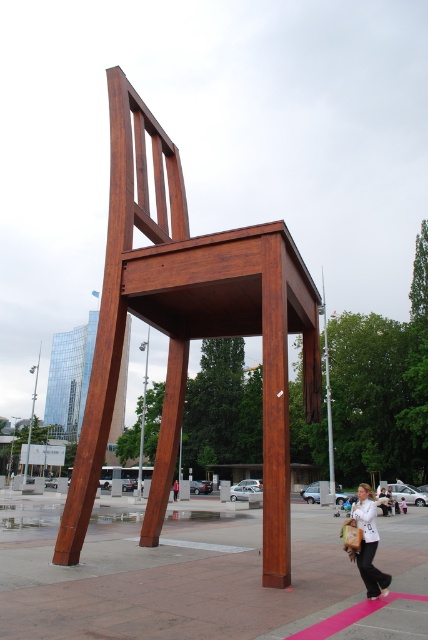
Is wooden chair at center positioned at the back of white cotton shirt at lower right?

Yes, wooden chair at center is behind white cotton shirt at lower right.

You are a GUI agent. You are given a task and a screenshot of the screen. Output one action in this format:
    pyautogui.click(x=<x>, y=<y>)
    Task: Click on the wooden chair at center
    The width and height of the screenshot is (428, 640).
    Given the screenshot: What is the action you would take?
    pyautogui.click(x=190, y=324)

Find the location of a particular element. The image size is (428, 640). wooden chair at center is located at coordinates (190, 324).

Identify the location of wooden chair at center. (190, 324).

Describe the element at coordinates (190, 324) in the screenshot. This screenshot has width=428, height=640. I see `wooden chair at center` at that location.

Is point (83, 438) closer to viewer compared to point (177, 483)?

That is True.

In order to click on wooden chair at center in this screenshot , I will do `click(190, 324)`.

Looking at this image, does white cotton shirt at lower right have a greater height compared to white fabric bag at lower center?

Correct, white cotton shirt at lower right is much taller as white fabric bag at lower center.

I want to click on white cotton shirt at lower right, so click(x=365, y=541).

What do you see at coordinates (365, 541) in the screenshot?
I see `white cotton shirt at lower right` at bounding box center [365, 541].

In order to click on white cotton shirt at lower right in this screenshot , I will do `click(365, 541)`.